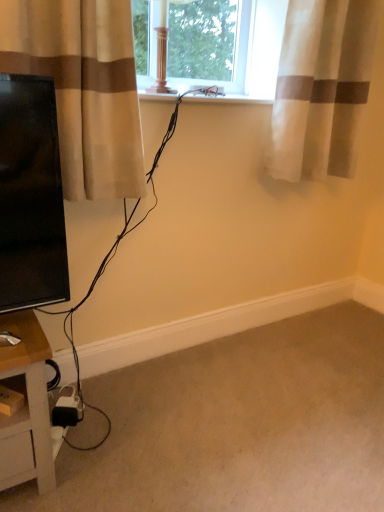
Question: From the image's perspective, is beige fabric curtain at left, the second curtain in the right-to-left sequence, located beneath sheer fabric curtain at upper right, arranged as the 1th curtain when viewed from the back?

Choices:
 (A) no
 (B) yes

Answer: (B)

Question: Are beige fabric curtain at left, which is the 1th curtain from front to back, and sheer fabric curtain at upper right, arranged as the 1th curtain when viewed from the back, beside each other?

Choices:
 (A) yes
 (B) no

Answer: (B)

Question: From a real-world perspective, is beige fabric curtain at left, which is the 1th curtain from front to back, located higher than sheer fabric curtain at upper right, arranged as the 1th curtain when viewed from the back?

Choices:
 (A) no
 (B) yes

Answer: (A)

Question: Considering the relative positions of beige fabric curtain at left, which is the first curtain in left-to-right order, and sheer fabric curtain at upper right, positioned as the 1th curtain in right-to-left order, in the image provided, is beige fabric curtain at left, which is the first curtain in left-to-right order, to the right of sheer fabric curtain at upper right, positioned as the 1th curtain in right-to-left order, from the viewer's perspective?

Choices:
 (A) yes
 (B) no

Answer: (B)

Question: Considering the relative sizes of beige fabric curtain at left, the second curtain when ordered from back to front, and sheer fabric curtain at upper right, placed as the 2th curtain when sorted from left to right, in the image provided, is beige fabric curtain at left, the second curtain when ordered from back to front, shorter than sheer fabric curtain at upper right, placed as the 2th curtain when sorted from left to right,?

Choices:
 (A) no
 (B) yes

Answer: (B)

Question: From a real-world perspective, is beige carpet at lower right positioned above or below beige fabric curtain at left, which is the 1th curtain from front to back?

Choices:
 (A) below
 (B) above

Answer: (A)

Question: Considering the positions of point (188, 436) and point (18, 28), is point (188, 436) closer or farther from the camera than point (18, 28)?

Choices:
 (A) farther
 (B) closer

Answer: (A)

Question: From their relative heights in the image, would you say beige carpet at lower right is taller or shorter than beige fabric curtain at left, which is the first curtain in left-to-right order?

Choices:
 (A) tall
 (B) short

Answer: (B)

Question: Which is correct: beige carpet at lower right is inside beige fabric curtain at left, the second curtain in the right-to-left sequence, or outside of it?

Choices:
 (A) inside
 (B) outside

Answer: (B)

Question: Considering the positions of beige fabric curtain at left, the second curtain in the right-to-left sequence, and sheer fabric curtain at upper right, placed as the 2th curtain when sorted from left to right, in the image, is beige fabric curtain at left, the second curtain in the right-to-left sequence, bigger or smaller than sheer fabric curtain at upper right, placed as the 2th curtain when sorted from left to right,?

Choices:
 (A) small
 (B) big

Answer: (A)

Question: Considering the positions of beige fabric curtain at left, the second curtain when ordered from back to front, and sheer fabric curtain at upper right, positioned as the 1th curtain in right-to-left order, in the image, is beige fabric curtain at left, the second curtain when ordered from back to front, taller or shorter than sheer fabric curtain at upper right, positioned as the 1th curtain in right-to-left order,?

Choices:
 (A) short
 (B) tall

Answer: (A)

Question: Is beige fabric curtain at left, the second curtain when ordered from back to front, wider or thinner than sheer fabric curtain at upper right, the second curtain in the front-to-back sequence?

Choices:
 (A) thin
 (B) wide

Answer: (B)

Question: Does point (21, 41) appear closer or farther from the camera than point (342, 25)?

Choices:
 (A) closer
 (B) farther

Answer: (A)

Question: Do you think sheer fabric curtain at upper right, positioned as the 1th curtain in right-to-left order, is within beige fabric curtain at left, which is the first curtain in left-to-right order, or outside of it?

Choices:
 (A) outside
 (B) inside

Answer: (A)

Question: From the image's perspective, is sheer fabric curtain at upper right, positioned as the 1th curtain in right-to-left order, above or below beige fabric curtain at left, which is the 1th curtain from front to back?

Choices:
 (A) above
 (B) below

Answer: (A)